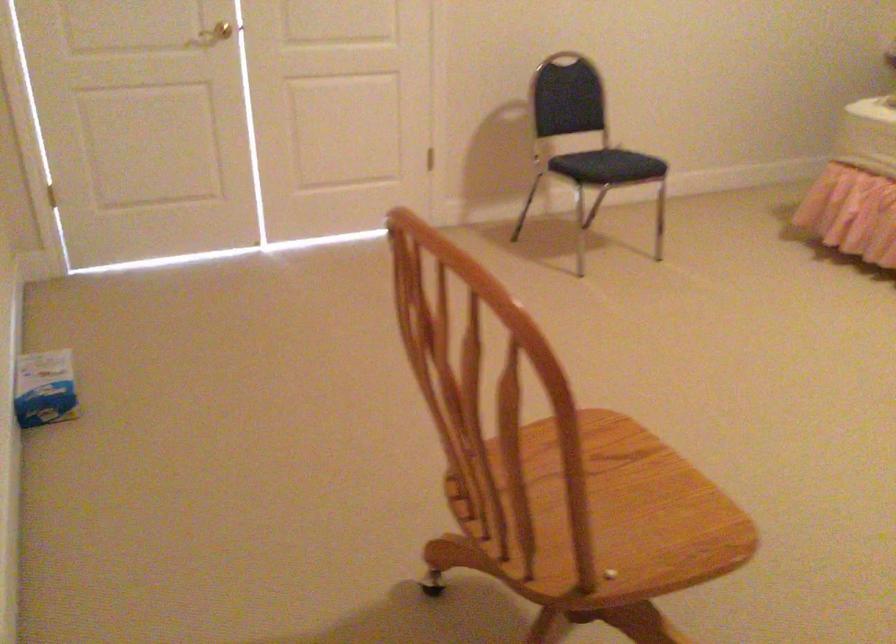
This screenshot has width=896, height=644. What are the coordinates of `black chair sitting surface` in the screenshot? It's located at (607, 166).